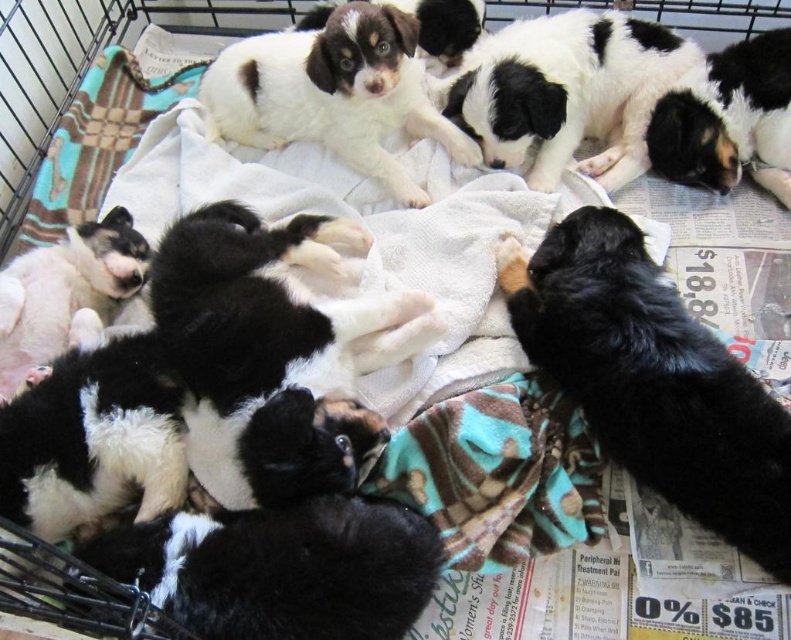
You are an animal caretaker looking at the cage with puppies. Where is the black soft fur at center located in terms of coordinates?

The black soft fur at center is located at point (275, 353).

In the scene shown: You are a veterinarian examining the cage of puppies. You notice the black soft fur at center and the black and white fur at upper center. Which fur is positioned lower in the cage?

The black soft fur at center is located below the black and white fur at upper center, so the black soft fur at center is positioned lower in the cage.